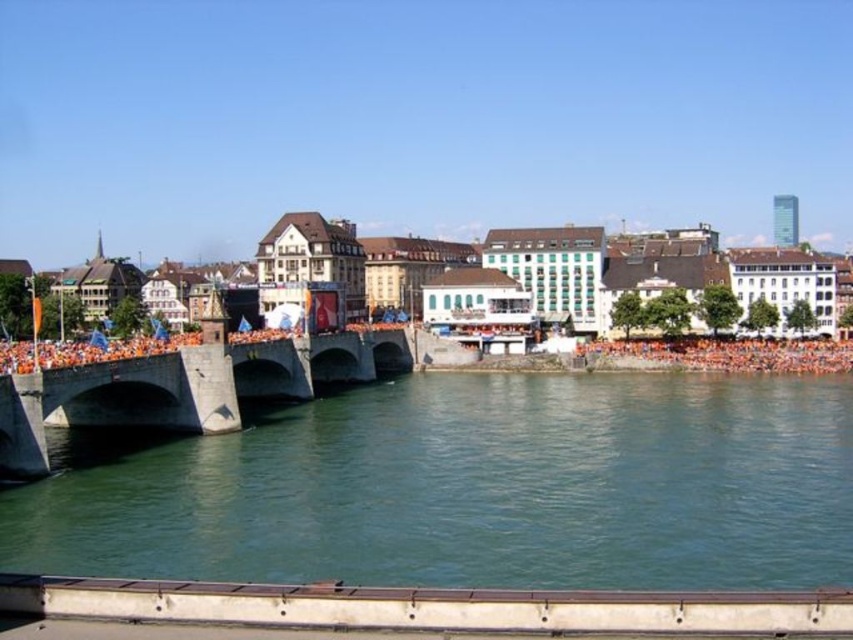
Can you confirm if concrete bridge at center is bigger than orange cloth crowd at lower right?

Correct, concrete bridge at center is larger in size than orange cloth crowd at lower right.

Is concrete bridge at center to the left of orange cloth crowd at lower right from the viewer's perspective?

Indeed, concrete bridge at center is positioned on the left side of orange cloth crowd at lower right.

Image resolution: width=853 pixels, height=640 pixels. Find the location of `concrete bridge at center`. concrete bridge at center is located at coordinates (198, 385).

Locate an element on the screen. The image size is (853, 640). concrete bridge at center is located at coordinates (198, 385).

Who is more forward, (633, 442) or (187, 358)?

Point (187, 358) is more forward.

In the scene shown: Who is positioned more to the left, green stone river at center or concrete bridge at center?

concrete bridge at center is more to the left.

Between point (554, 426) and point (155, 424), which one is positioned behind?

The point (554, 426) is more distant.

The width and height of the screenshot is (853, 640). What are the coordinates of `green stone river at center` in the screenshot? It's located at (469, 486).

What do you see at coordinates (469, 486) in the screenshot? I see `green stone river at center` at bounding box center [469, 486].

Between green stone river at center and orange cloth crowd at lower right, which one has more height?

Standing taller between the two is green stone river at center.

Is point (791, 458) closer to camera compared to point (608, 342)?

Yes.

Where is `green stone river at center`? The width and height of the screenshot is (853, 640). green stone river at center is located at coordinates (469, 486).